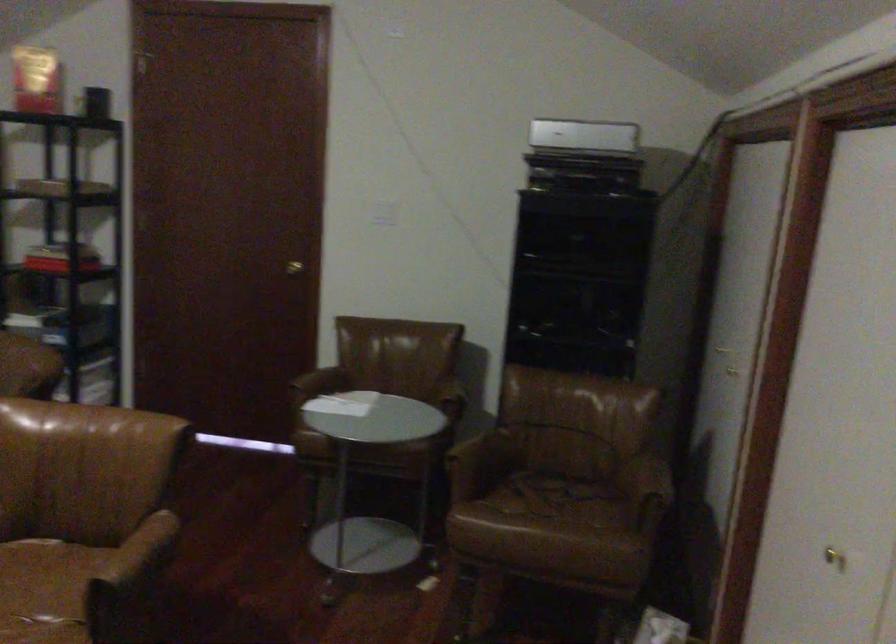
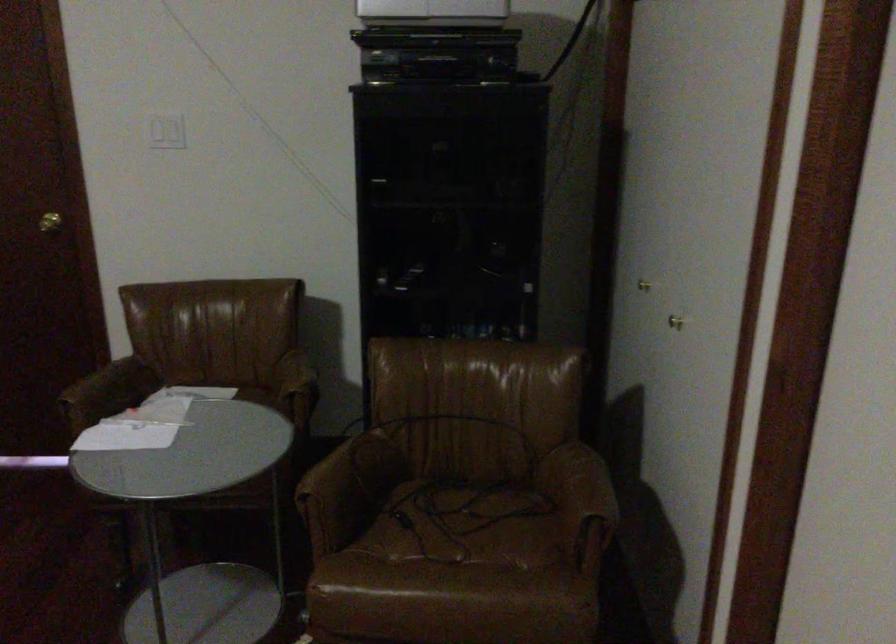
Question: In a continuous first-person perspective shot, in which direction is the camera moving?

Choices:
 (A) Left
 (B) Right
 (C) Forward
 (D) Backward

Answer: (C)